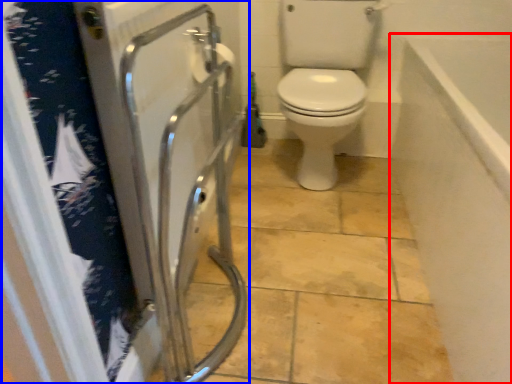
Question: Among these objects, which one is nearest to the camera, bath (highlighted by a red box) or screen door (highlighted by a blue box)?

Choices:
 (A) bath
 (B) screen door

Answer: (B)